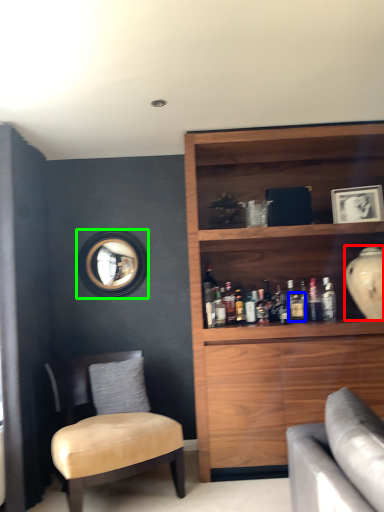
Question: Considering the real-world distances, which object is closest to glass vase (highlighted by a red box)? beverage (highlighted by a blue box) or mirror (highlighted by a green box).

Choices:
 (A) beverage
 (B) mirror

Answer: (A)